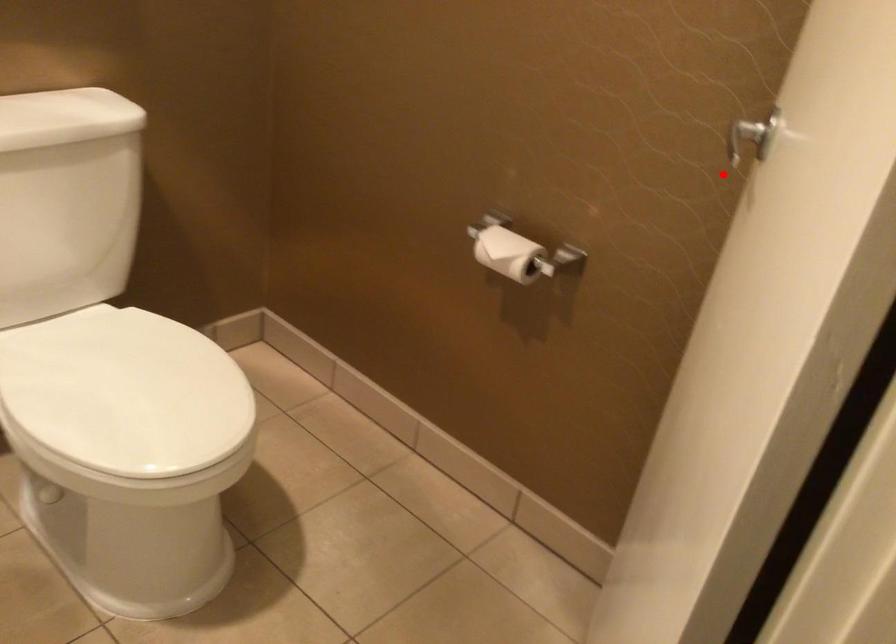
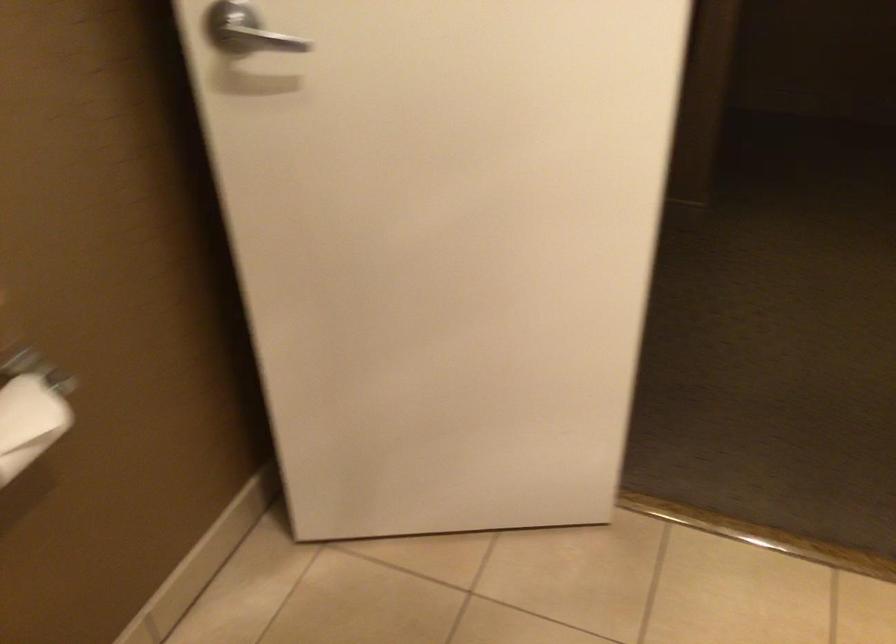
Locate, in the second image, the point that corresponds to the highlighted location in the first image.

(257, 39)